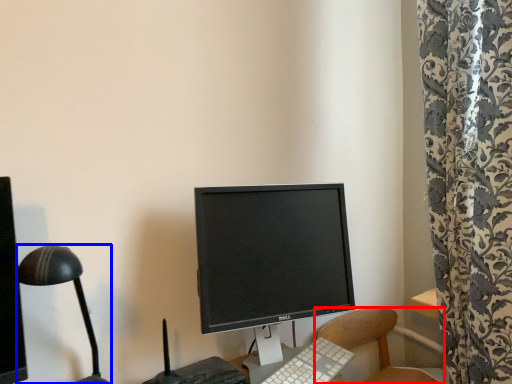
Question: Which point is closer to the camera, chair (highlighted by a red box) or lamp (highlighted by a blue box)?

Choices:
 (A) chair
 (B) lamp

Answer: (B)